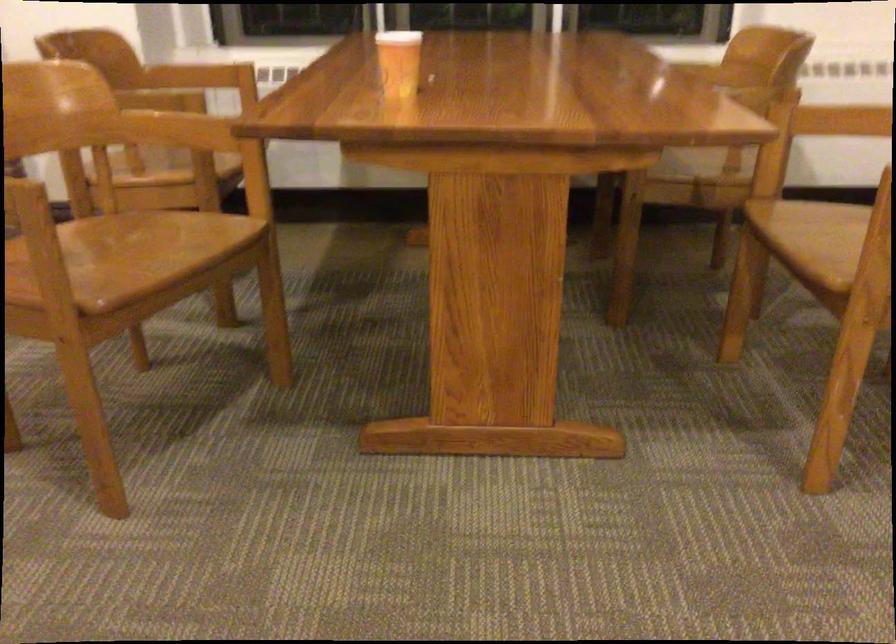
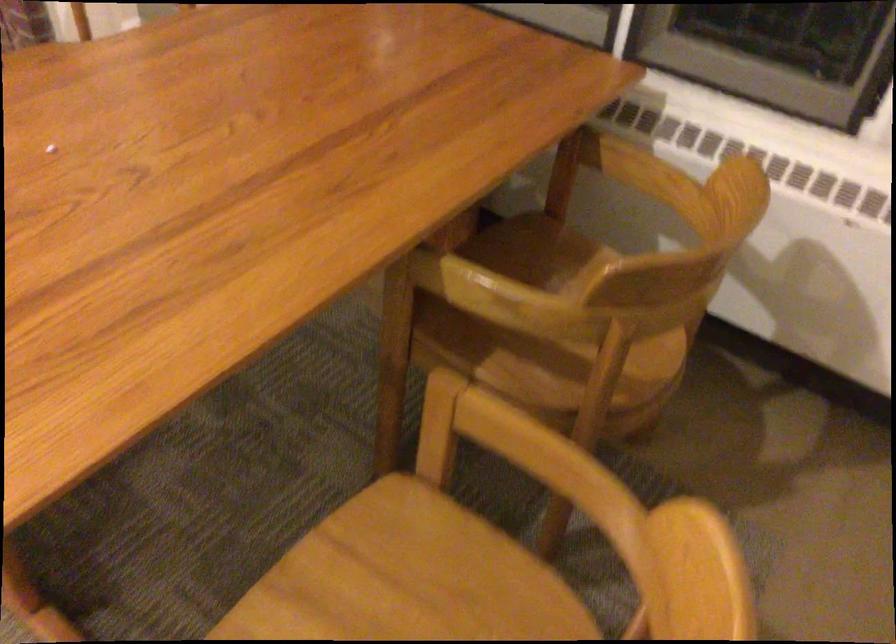
Locate, in the second image, the point that corresponds to (819,211) in the first image.

(407, 579)